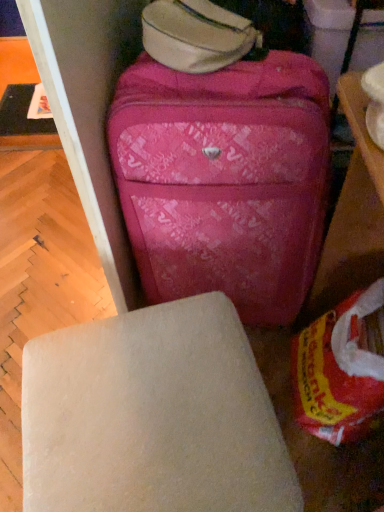
Question: In the image, is matte white table at upper right, marked as the second table in a top-to-bottom arrangement, on the left side or the right side of pink fabric suitcase at center?

Choices:
 (A) left
 (B) right

Answer: (B)

Question: Is matte white table at upper right, arranged as the second table when viewed from the left, taller or shorter than pink fabric suitcase at center?

Choices:
 (A) short
 (B) tall

Answer: (A)

Question: Which object is the farthest from the matte white table at upper right, acting as the 1th table starting from the bottom?

Choices:
 (A) white matte stool at center
 (B) black plastic table at upper left, marked as the second table in a right-to-left arrangement
 (C) pink fabric suitcase at center

Answer: (B)

Question: Which object is positioned closest to the black plastic table at upper left, which appears as the 1th table when viewed from the back?

Choices:
 (A) white matte stool at center
 (B) matte white table at upper right, acting as the 1th table starting from the bottom
 (C) pink fabric suitcase at center

Answer: (C)